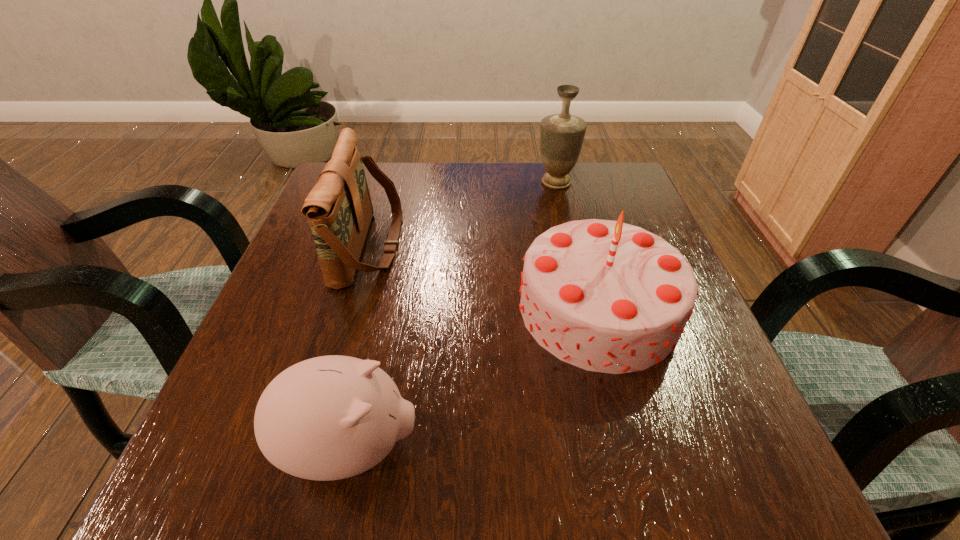
Locate an element on the screen. Image resolution: width=960 pixels, height=540 pixels. blank space at the near edge of the desktop is located at coordinates (522, 444).

At what (x,y) coordinates should I click in order to perform the action: click on vacant space at the left edge. Please return your answer as a coordinate pair (x, y). The image size is (960, 540). Looking at the image, I should click on (258, 350).

The height and width of the screenshot is (540, 960). I want to click on free space at the right edge of the desktop, so click(709, 426).

Where is `free location at the far right corner`? free location at the far right corner is located at coordinates (619, 200).

In order to click on free point between the birthday cake and the shoulder bag in this screenshot , I will do `click(484, 277)`.

This screenshot has width=960, height=540. What are the coordinates of `free space between the urn and the shoulder bag` in the screenshot? It's located at (463, 214).

You are a GUI agent. You are given a task and a screenshot of the screen. Output one action in this format:
    pyautogui.click(x=<x>, y=<y>)
    Task: Click on the empty space that is in between the birthday cake and the shortest object
    The width and height of the screenshot is (960, 540).
    Given the screenshot: What is the action you would take?
    pyautogui.click(x=474, y=378)

Locate an element on the screen. vacant area between the piggy bank and the birthday cake is located at coordinates (474, 378).

At what (x,y) coordinates should I click in order to perform the action: click on vacant area between the shoulder bag and the urn. Please return your answer as a coordinate pair (x, y). Image resolution: width=960 pixels, height=540 pixels. Looking at the image, I should click on (463, 214).

This screenshot has height=540, width=960. Find the location of `vacant space that is in between the piggy bank and the birthday cake`. vacant space that is in between the piggy bank and the birthday cake is located at coordinates (474, 378).